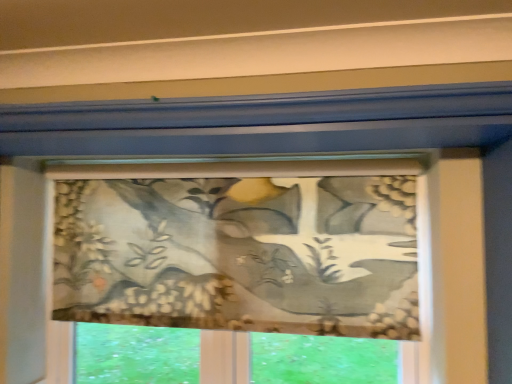
Question: Should I look upward or downward to see textured floral fabric at center?

Choices:
 (A) up
 (B) down

Answer: (B)